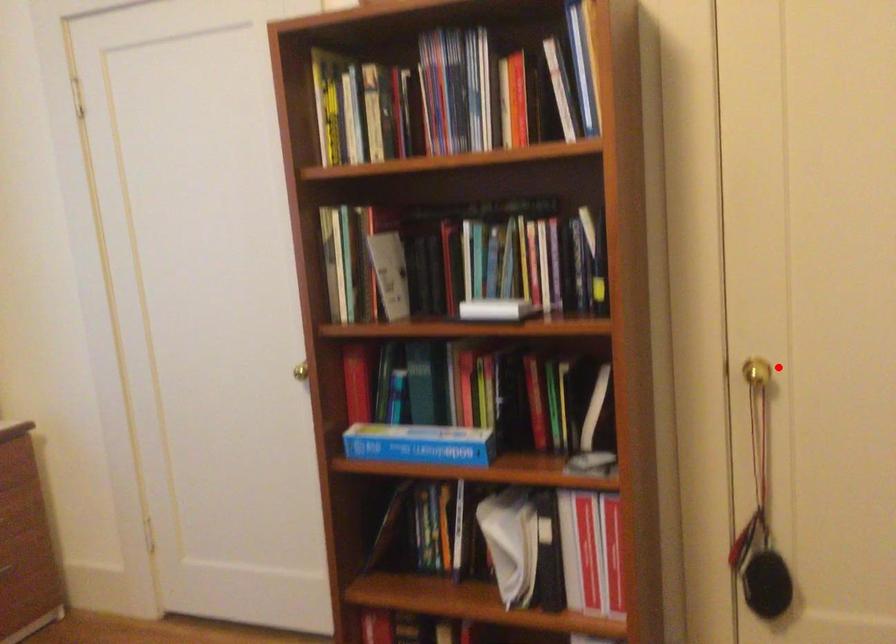
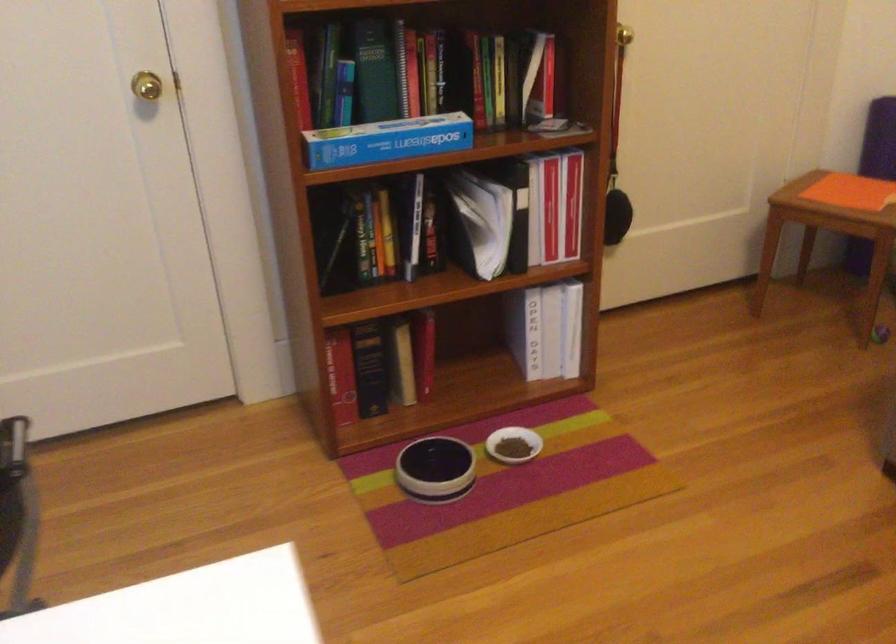
Find the pixel in the second image that matches the highlighted location in the first image.

(624, 35)